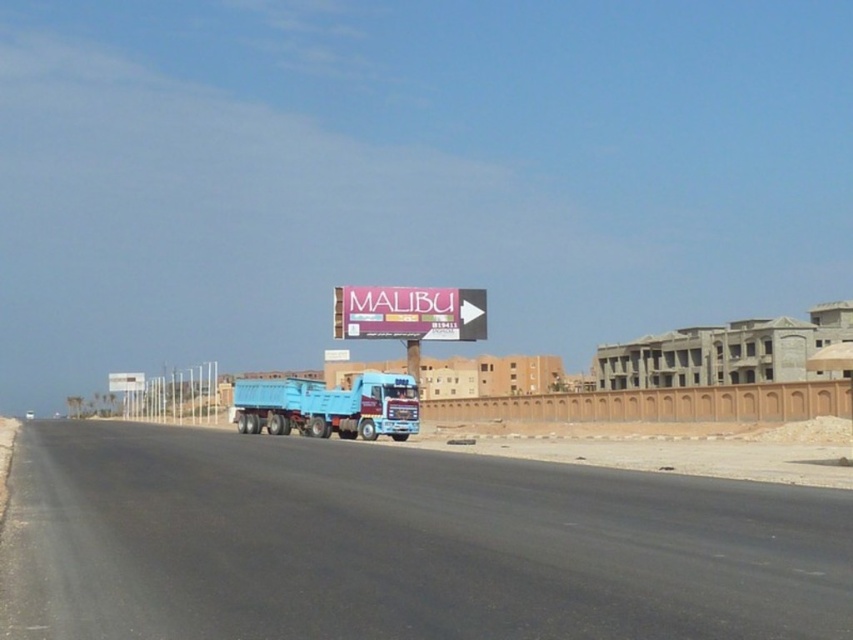
Describe the element at coordinates (329, 406) in the screenshot. The width and height of the screenshot is (853, 640). I see `blue matte truck at center` at that location.

Who is positioned more to the left, blue matte truck at center or purple matte billboard at center?

Positioned to the left is blue matte truck at center.

Where is `blue matte truck at center`? This screenshot has width=853, height=640. blue matte truck at center is located at coordinates (329, 406).

Image resolution: width=853 pixels, height=640 pixels. Identify the location of black asphalt highway at center. (399, 545).

Does black asphalt highway at center have a smaller size compared to blue matte truck at center?

Correct, black asphalt highway at center occupies less space than blue matte truck at center.

The height and width of the screenshot is (640, 853). What do you see at coordinates (399, 545) in the screenshot?
I see `black asphalt highway at center` at bounding box center [399, 545].

I want to click on black asphalt highway at center, so click(399, 545).

Is black asphalt highway at center bigger than purple matte billboard at center?

Yes.

Does point (440, 576) come farther from viewer compared to point (409, 337)?

No, it is not.

Find the location of a particular element. The image size is (853, 640). black asphalt highway at center is located at coordinates (399, 545).